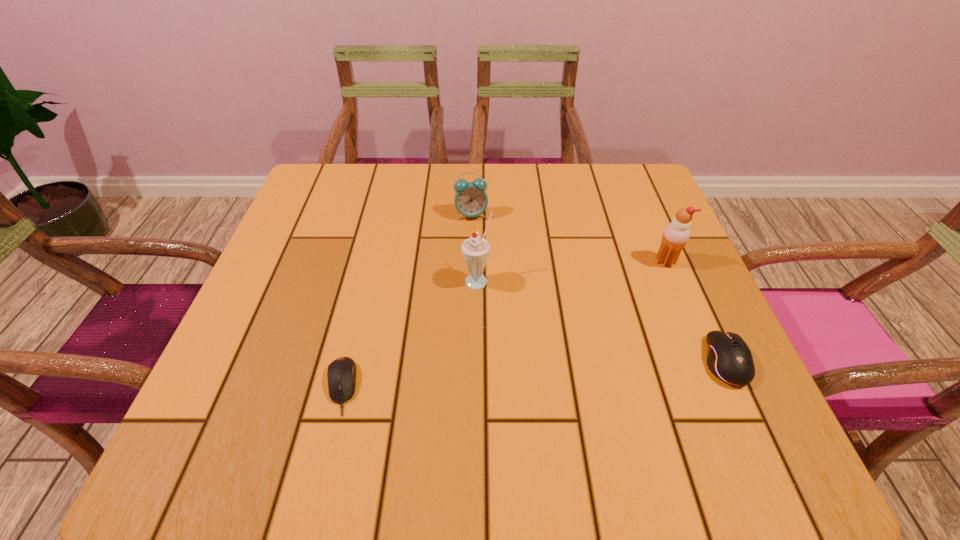
You are a GUI agent. You are given a task and a screenshot of the screen. Output one action in this format:
    pyautogui.click(x=<x>, y=<y>)
    Task: Click on the computer mouse positioned at the right edge
    Image resolution: width=960 pixels, height=540 pixels.
    Given the screenshot: What is the action you would take?
    pyautogui.click(x=729, y=358)

You are a GUI agent. You are given a task and a screenshot of the screen. Output one action in this format:
    pyautogui.click(x=<x>, y=<y>)
    Task: Click on the icecream situated at the right edge
    The image size is (960, 540).
    Given the screenshot: What is the action you would take?
    pyautogui.click(x=676, y=234)

At what (x,y) coordinates should I click in order to perform the action: click on object that is at the near right corner. Please return your answer as a coordinate pair (x, y). The height and width of the screenshot is (540, 960). Looking at the image, I should click on (729, 358).

You are a GUI agent. You are given a task and a screenshot of the screen. Output one action in this format:
    pyautogui.click(x=<x>, y=<y>)
    Task: Click on the vacant space at the far edge of the desktop
    The image size is (960, 540).
    Given the screenshot: What is the action you would take?
    pyautogui.click(x=448, y=174)

Where is `free space at the near edge`? free space at the near edge is located at coordinates (530, 394).

In the image, there is a desktop. Where is `vacant space at the left edge`? vacant space at the left edge is located at coordinates (333, 231).

This screenshot has width=960, height=540. Find the location of `vacant space at the right edge`. vacant space at the right edge is located at coordinates tap(645, 248).

In the image, there is a desktop. Where is `vacant area at the far left corner`? vacant area at the far left corner is located at coordinates (316, 199).

You are a GUI agent. You are given a task and a screenshot of the screen. Output one action in this format:
    pyautogui.click(x=<x>, y=<y>)
    Task: Click on the blank space at the near left corner of the desktop
    
    Given the screenshot: What is the action you would take?
    pyautogui.click(x=219, y=382)

You are a GUI agent. You are given a task and a screenshot of the screen. Output one action in this format:
    pyautogui.click(x=<x>, y=<y>)
    Task: Click on the free space at the far right corner of the desktop
    This screenshot has height=540, width=960.
    Given the screenshot: What is the action you would take?
    pyautogui.click(x=647, y=172)